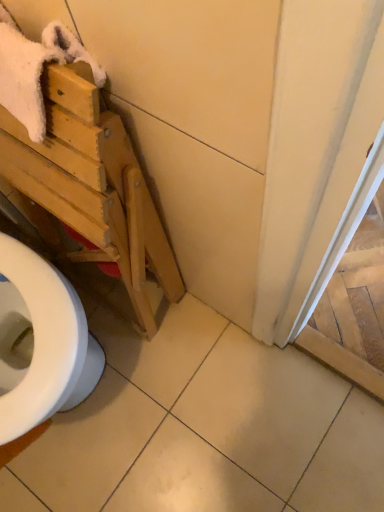
This screenshot has height=512, width=384. Find the location of `free space in front of light wood folding chair at left`. free space in front of light wood folding chair at left is located at coordinates (180, 382).